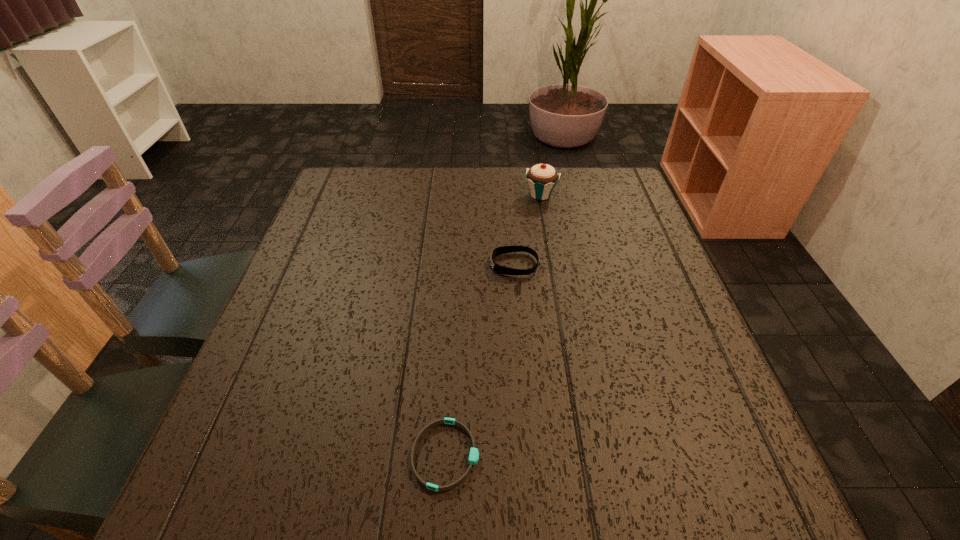
Identify the location of cupcake. The image size is (960, 540). (542, 178).

The width and height of the screenshot is (960, 540). I want to click on the tallest object, so click(542, 178).

Where is `the second farthest object`? The width and height of the screenshot is (960, 540). the second farthest object is located at coordinates (497, 251).

This screenshot has width=960, height=540. In order to click on the farther wristband in this screenshot , I will do `click(497, 251)`.

The height and width of the screenshot is (540, 960). Find the location of `the nearest object`. the nearest object is located at coordinates (474, 454).

I want to click on the nearer wristband, so click(474, 454).

Where is `vacant space located on the front of the cupcake`? The image size is (960, 540). vacant space located on the front of the cupcake is located at coordinates (x=556, y=282).

You are a GUI agent. You are given a task and a screenshot of the screen. Output one action in this format:
    pyautogui.click(x=<x>, y=<y>)
    Task: Click on the blank space located 0.350m on the display of the second shortest object
    The height and width of the screenshot is (540, 960).
    Given the screenshot: What is the action you would take?
    pyautogui.click(x=345, y=264)

Where is `vacant area situated 0.320m on the display of the second shortest object`? This screenshot has height=540, width=960. vacant area situated 0.320m on the display of the second shortest object is located at coordinates (357, 264).

Locate an element on the screen. The width and height of the screenshot is (960, 540). free region located 0.140m on the display of the second shortest object is located at coordinates (432, 264).